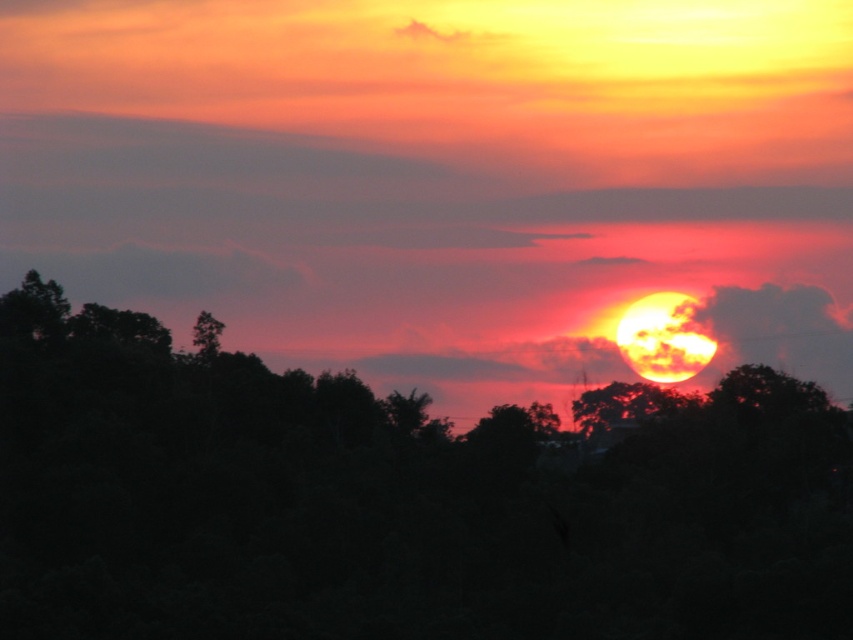
Is silhouette tree at center positioned at the back of green leafy tree at upper left?

That is False.

Is point (554, 451) closer to camera compared to point (206, 330)?

Yes, point (554, 451) is closer to viewer.

The width and height of the screenshot is (853, 640). What are the coordinates of `silhouette tree at center` in the screenshot? It's located at (399, 500).